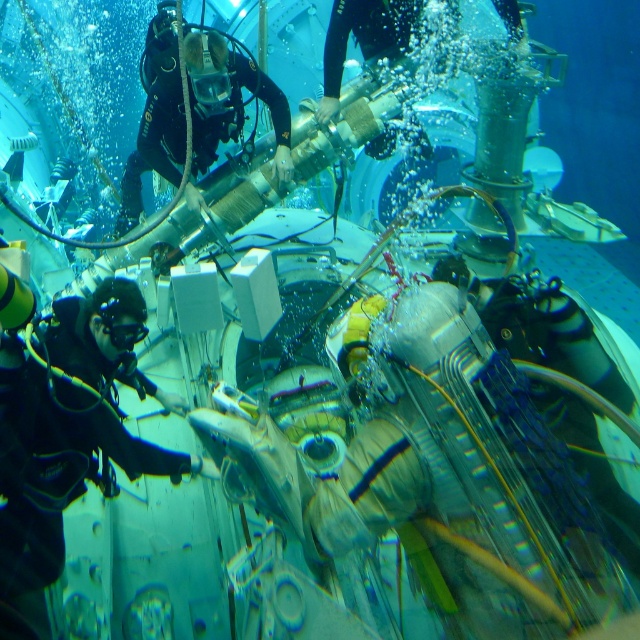
Between black rubber diver at upper left and black matte goggles at center, which one has less height?

Standing shorter between the two is black matte goggles at center.

Does black rubber diver at upper left have a smaller size compared to black matte goggles at center?

Actually, black rubber diver at upper left might be larger than black matte goggles at center.

What are the coordinates of `black rubber diver at upper left` in the screenshot? It's located at (228, 99).

Based on the photo, how distant is black rubber diving suit at left from black matte goggles at center?

black rubber diving suit at left and black matte goggles at center are 11.51 inches apart from each other.

Can you confirm if black rubber diving suit at left is wider than black matte goggles at center?

Yes, black rubber diving suit at left is wider than black matte goggles at center.

Does point (13, 552) lie in front of point (109, 330)?

Yes, it is.

I want to click on black rubber diving suit at left, so pos(65,436).

Is black rubber diving suit at left thinner than black rubber diver at upper left?

Yes.

Based on the photo, who is lower down, black rubber diving suit at left or black rubber diver at upper left?

black rubber diving suit at left is lower down.

Measure the distance between point [88,468] and camera.

The distance of point [88,468] from camera is 2.68 meters.

Locate an element on the screen. The height and width of the screenshot is (640, 640). black rubber diving suit at left is located at coordinates (65, 436).